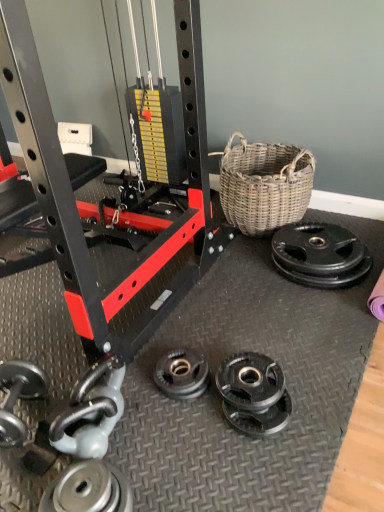
The image size is (384, 512). Identify the location of free space on the front side of silver metallic dumbbell at lower left. (124, 478).